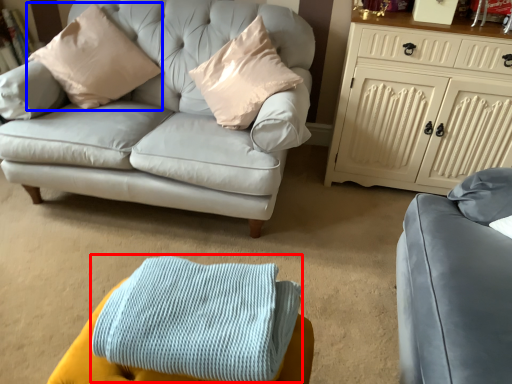
Question: Which object appears closest to the camera in this image, blanket (highlighted by a red box) or pillow (highlighted by a blue box)?

Choices:
 (A) blanket
 (B) pillow

Answer: (A)